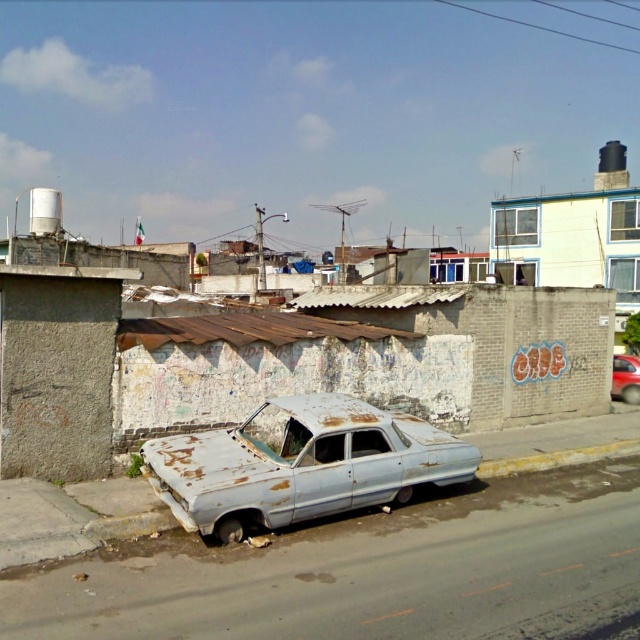
Can you confirm if rusty metal car at center is thinner than shiny red car at right?

In fact, rusty metal car at center might be wider than shiny red car at right.

Which is above, rusty metal car at center or shiny red car at right?

shiny red car at right

Does point (333, 445) lie behind point (616, 390)?

That is False.

Find the location of `rusty metal car at center`. rusty metal car at center is located at coordinates [300, 464].